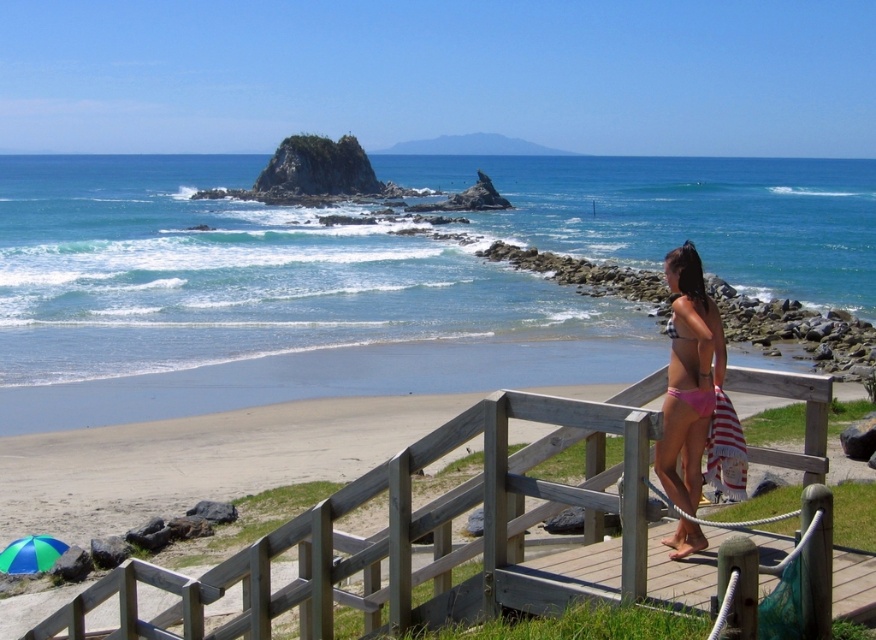
Question: Based on their relative distances, which object is nearer to the green fabric umbrella at lower left?

Choices:
 (A) pink fabric bikini at right
 (B) wooden at center
 (C) pink bikini at center

Answer: (B)

Question: Is pink bikini at center smaller than pink fabric bikini at right?

Choices:
 (A) yes
 (B) no

Answer: (B)

Question: Which object is positioned closest to the wooden at center?

Choices:
 (A) pink bikini at center
 (B) green fabric umbrella at lower left
 (C) pink fabric bikini at right

Answer: (B)

Question: Which point is closer to the camera?

Choices:
 (A) pyautogui.click(x=62, y=548)
 (B) pyautogui.click(x=701, y=291)
 (C) pyautogui.click(x=696, y=376)

Answer: (C)

Question: Is pink bikini at center smaller than green fabric umbrella at lower left?

Choices:
 (A) yes
 (B) no

Answer: (B)

Question: Can you confirm if wooden at center is wider than pink bikini at center?

Choices:
 (A) no
 (B) yes

Answer: (B)